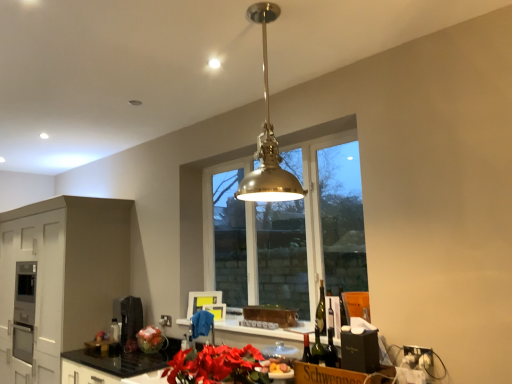
The height and width of the screenshot is (384, 512). Identify the location of free spot above brass/polished metal pendant light at center (from a real-world perspective). 244,14.